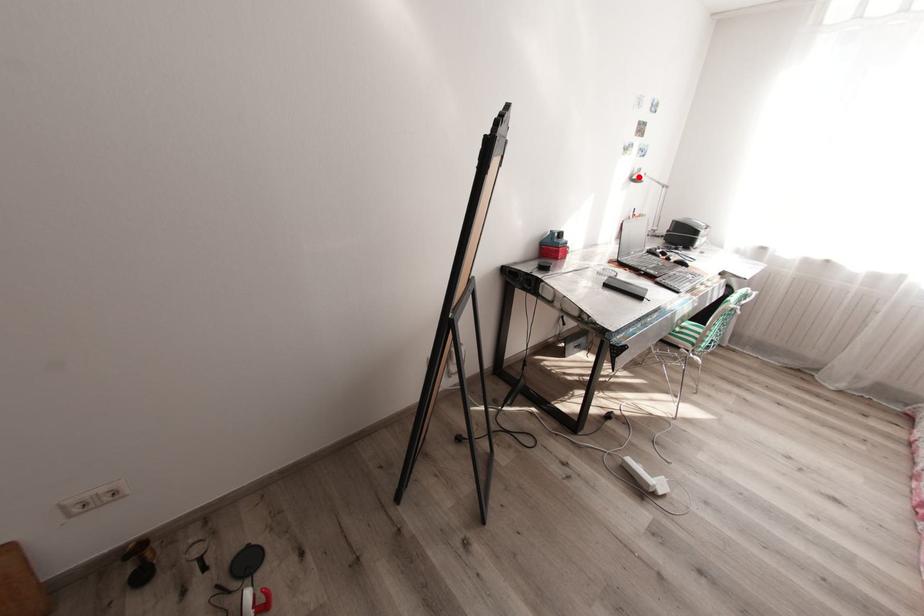
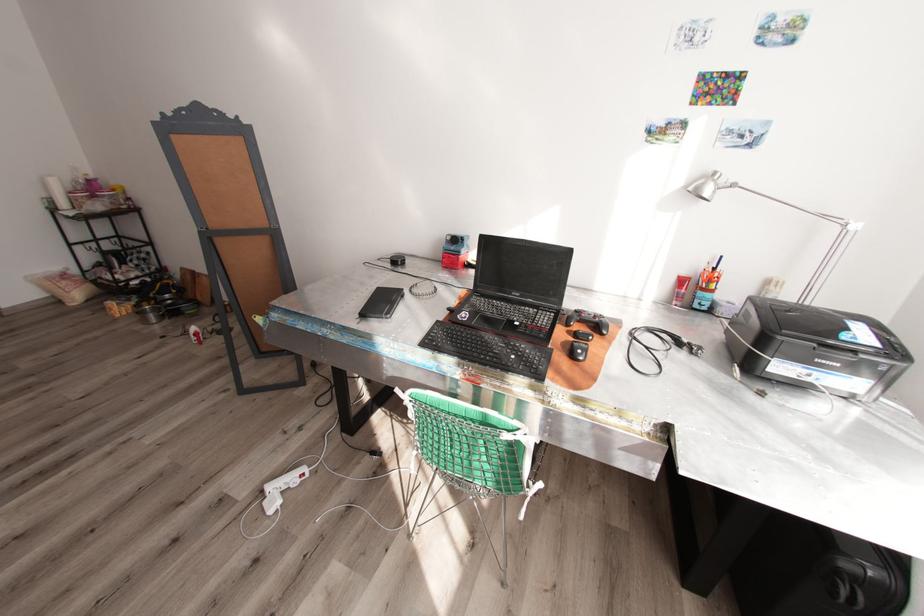
The point at the highlighted location is marked in the first image. Where is the corresponding point in the second image?

(695, 188)